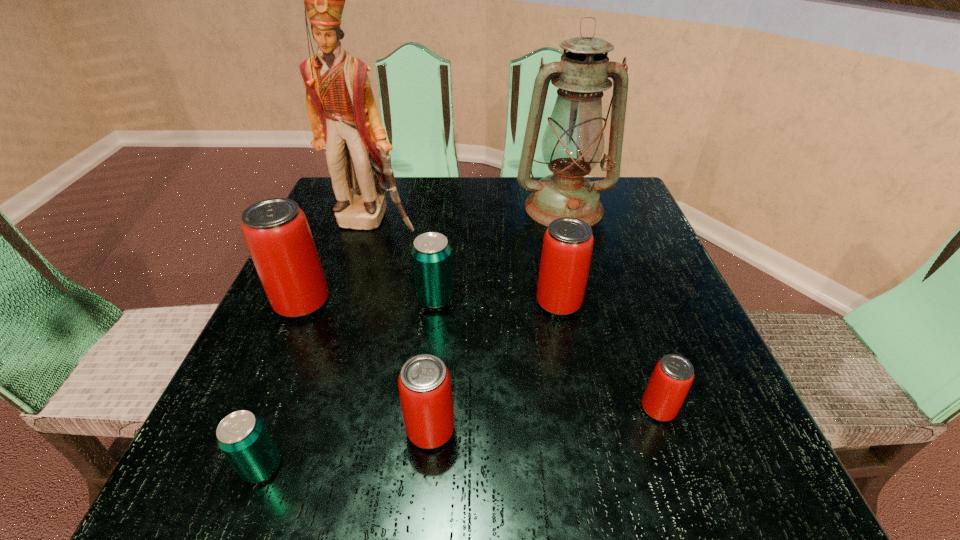
The image size is (960, 540). I want to click on nutcracker, so click(x=342, y=110).

Where is `oil lamp`? This screenshot has height=540, width=960. oil lamp is located at coordinates (573, 143).

Where is `the biggest pink beer can`? This screenshot has width=960, height=540. the biggest pink beer can is located at coordinates (276, 231).

The height and width of the screenshot is (540, 960). Find the location of `the tallest beer can`. the tallest beer can is located at coordinates (276, 231).

Locate an element on the screen. The image size is (960, 540). the third pink beer can from left to right is located at coordinates (567, 247).

The height and width of the screenshot is (540, 960). Identify the location of the fifth beer can from left to right. (567, 247).

Locate an element on the screen. The height and width of the screenshot is (540, 960). the right teal beer can is located at coordinates (431, 254).

You are a GUI agent. You are given a task and a screenshot of the screen. Output one action in this format:
    pyautogui.click(x=<x>, y=<y>)
    Task: Click on the farther teal beer can
    
    Given the screenshot: What is the action you would take?
    pyautogui.click(x=431, y=254)

This screenshot has height=540, width=960. I want to click on the second pink beer can from left to right, so click(x=424, y=382).

What are the coordinates of `the rightmost pink beer can` in the screenshot? It's located at (673, 375).